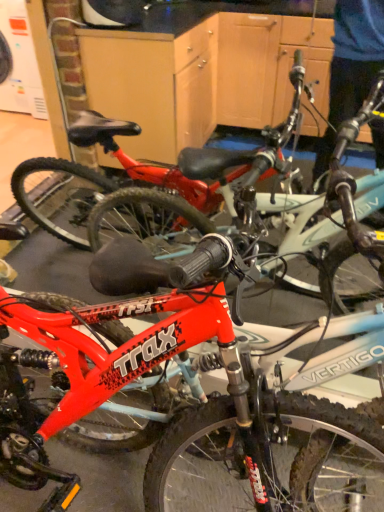
Locate an element on the screen. The image size is (384, 512). shiny red bicycle at center, the 2th bicycle in the bottom-to-top sequence is located at coordinates (243, 206).

Describe the element at coordinates (243, 206) in the screenshot. I see `shiny red bicycle at center, the 2th bicycle in the bottom-to-top sequence` at that location.

What do you see at coordinates (192, 399) in the screenshot? The height and width of the screenshot is (512, 384). I see `shiny red bicycle at center, positioned as the 1th bicycle in bottom-to-top order` at bounding box center [192, 399].

Based on the photo, how much space does shiny red bicycle at center, positioned as the 1th bicycle in bottom-to-top order, occupy horizontally?

shiny red bicycle at center, positioned as the 1th bicycle in bottom-to-top order, is 59.88 centimeters wide.

Locate an element on the screen. This screenshot has height=512, width=384. shiny red bicycle at center, marked as the 2th bicycle in a top-to-bottom arrangement is located at coordinates (192, 399).

I want to click on shiny red bicycle at center, the first bicycle viewed from the top, so (243, 206).

Between shiny red bicycle at center, the 2th bicycle in the bottom-to-top sequence, and shiny red bicycle at center, positioned as the 1th bicycle in bottom-to-top order, which one appears on the right side from the viewer's perspective?

From the viewer's perspective, shiny red bicycle at center, positioned as the 1th bicycle in bottom-to-top order, appears more on the right side.

In the scene shown: Which object is further away from the camera, shiny red bicycle at center, the first bicycle viewed from the top, or shiny red bicycle at center, positioned as the 1th bicycle in bottom-to-top order?

shiny red bicycle at center, the first bicycle viewed from the top.

Is point (374, 203) less distant than point (109, 420)?

Yes, it is.

From the image's perspective, is shiny red bicycle at center, the first bicycle viewed from the top, over shiny red bicycle at center, marked as the 2th bicycle in a top-to-bottom arrangement?

Yes, from the image's perspective, shiny red bicycle at center, the first bicycle viewed from the top, is over shiny red bicycle at center, marked as the 2th bicycle in a top-to-bottom arrangement.

Looking at this image, from a real-world perspective, is shiny red bicycle at center, the 2th bicycle in the bottom-to-top sequence, on top of shiny red bicycle at center, positioned as the 1th bicycle in bottom-to-top order?

Yes.

Consider the image. Between shiny red bicycle at center, the first bicycle viewed from the top, and shiny red bicycle at center, positioned as the 1th bicycle in bottom-to-top order, which one has smaller width?

With smaller width is shiny red bicycle at center, the first bicycle viewed from the top.

Who is shorter, shiny red bicycle at center, the first bicycle viewed from the top, or shiny red bicycle at center, positioned as the 1th bicycle in bottom-to-top order?

shiny red bicycle at center, the first bicycle viewed from the top, is shorter.

Between shiny red bicycle at center, the first bicycle viewed from the top, and shiny red bicycle at center, marked as the 2th bicycle in a top-to-bottom arrangement, which one has larger size?

Bigger between the two is shiny red bicycle at center, marked as the 2th bicycle in a top-to-bottom arrangement.

Is shiny red bicycle at center, the 2th bicycle in the bottom-to-top sequence, not within shiny red bicycle at center, marked as the 2th bicycle in a top-to-bottom arrangement?

No, shiny red bicycle at center, the 2th bicycle in the bottom-to-top sequence, is inside shiny red bicycle at center, marked as the 2th bicycle in a top-to-bottom arrangement,'s boundary.

Is shiny red bicycle at center, the first bicycle viewed from the top, far from shiny red bicycle at center, positioned as the 1th bicycle in bottom-to-top order?

No, shiny red bicycle at center, the first bicycle viewed from the top, is not far away from shiny red bicycle at center, positioned as the 1th bicycle in bottom-to-top order.

Is shiny red bicycle at center, the 2th bicycle in the bottom-to-top sequence, aimed at shiny red bicycle at center, positioned as the 1th bicycle in bottom-to-top order?

Yes.

Can you tell me how much shiny red bicycle at center, the first bicycle viewed from the top, and shiny red bicycle at center, marked as the 2th bicycle in a top-to-bottom arrangement, differ in facing direction?

shiny red bicycle at center, the first bicycle viewed from the top, and shiny red bicycle at center, marked as the 2th bicycle in a top-to-bottom arrangement, are facing 1.52 degrees away from each other.

How far apart are shiny red bicycle at center, the 2th bicycle in the bottom-to-top sequence, and shiny red bicycle at center, positioned as the 1th bicycle in bottom-to-top order?

shiny red bicycle at center, the 2th bicycle in the bottom-to-top sequence, is 15.80 inches from shiny red bicycle at center, positioned as the 1th bicycle in bottom-to-top order.

You are a GUI agent. You are given a task and a screenshot of the screen. Output one action in this format:
    pyautogui.click(x=<x>, y=<y>)
    Task: Click on the bicycle on the right of shiny red bicycle at center, the first bicycle viewed from the top
    
    Given the screenshot: What is the action you would take?
    pyautogui.click(x=192, y=399)

Between shiny red bicycle at center, positioned as the 1th bicycle in bottom-to-top order, and shiny red bicycle at center, the first bicycle viewed from the top, which one appears on the left side from the viewer's perspective?

shiny red bicycle at center, the first bicycle viewed from the top, is more to the left.

Is shiny red bicycle at center, positioned as the 1th bicycle in bottom-to-top order, behind shiny red bicycle at center, the 2th bicycle in the bottom-to-top sequence?

That is False.

Does point (112, 375) lie in front of point (364, 211)?

That is True.

From the image's perspective, is shiny red bicycle at center, marked as the 2th bicycle in a top-to-bottom arrangement, positioned above or below shiny red bicycle at center, the 2th bicycle in the bottom-to-top sequence?

shiny red bicycle at center, marked as the 2th bicycle in a top-to-bottom arrangement, is below shiny red bicycle at center, the 2th bicycle in the bottom-to-top sequence.

From a real-world perspective, is shiny red bicycle at center, positioned as the 1th bicycle in bottom-to-top order, located beneath shiny red bicycle at center, the 2th bicycle in the bottom-to-top sequence?

Yes, from a real-world perspective, shiny red bicycle at center, positioned as the 1th bicycle in bottom-to-top order, is under shiny red bicycle at center, the 2th bicycle in the bottom-to-top sequence.

Does shiny red bicycle at center, marked as the 2th bicycle in a top-to-bottom arrangement, have a greater width compared to shiny red bicycle at center, the 2th bicycle in the bottom-to-top sequence?

Yes, shiny red bicycle at center, marked as the 2th bicycle in a top-to-bottom arrangement, is wider than shiny red bicycle at center, the 2th bicycle in the bottom-to-top sequence.

Between shiny red bicycle at center, positioned as the 1th bicycle in bottom-to-top order, and shiny red bicycle at center, the 2th bicycle in the bottom-to-top sequence, which one has more height?

shiny red bicycle at center, positioned as the 1th bicycle in bottom-to-top order, is taller.

Can you confirm if shiny red bicycle at center, positioned as the 1th bicycle in bottom-to-top order, is smaller than shiny red bicycle at center, the 2th bicycle in the bottom-to-top sequence?

No, shiny red bicycle at center, positioned as the 1th bicycle in bottom-to-top order, is not smaller than shiny red bicycle at center, the 2th bicycle in the bottom-to-top sequence.

Choose the correct answer: Is shiny red bicycle at center, marked as the 2th bicycle in a top-to-bottom arrangement, inside shiny red bicycle at center, the 2th bicycle in the bottom-to-top sequence, or outside it?

The correct answer is: outside.

Is shiny red bicycle at center, positioned as the 1th bicycle in bottom-to-top order, not near shiny red bicycle at center, the first bicycle viewed from the top?

No, shiny red bicycle at center, positioned as the 1th bicycle in bottom-to-top order, is not far from shiny red bicycle at center, the first bicycle viewed from the top.

Is shiny red bicycle at center, positioned as the 1th bicycle in bottom-to-top order, aimed at shiny red bicycle at center, the first bicycle viewed from the top?

No.

How different are the orientations of shiny red bicycle at center, marked as the 2th bicycle in a top-to-bottom arrangement, and shiny red bicycle at center, the 2th bicycle in the bottom-to-top sequence, in degrees?

The angle between the facing direction of shiny red bicycle at center, marked as the 2th bicycle in a top-to-bottom arrangement, and the facing direction of shiny red bicycle at center, the 2th bicycle in the bottom-to-top sequence, is 1.52 degrees.

This screenshot has width=384, height=512. Identify the location of bicycle in front of the shiny red bicycle at center, the 2th bicycle in the bottom-to-top sequence. (192, 399).

Find the location of a particular element. bicycle on the right of the shiny red bicycle at center, the 2th bicycle in the bottom-to-top sequence is located at coordinates (x=192, y=399).

At what (x,y) coordinates should I click in order to perform the action: click on bicycle above the shiny red bicycle at center, positioned as the 1th bicycle in bottom-to-top order (from the image's perspective). Please return your answer as a coordinate pair (x, y). Looking at the image, I should click on (243, 206).